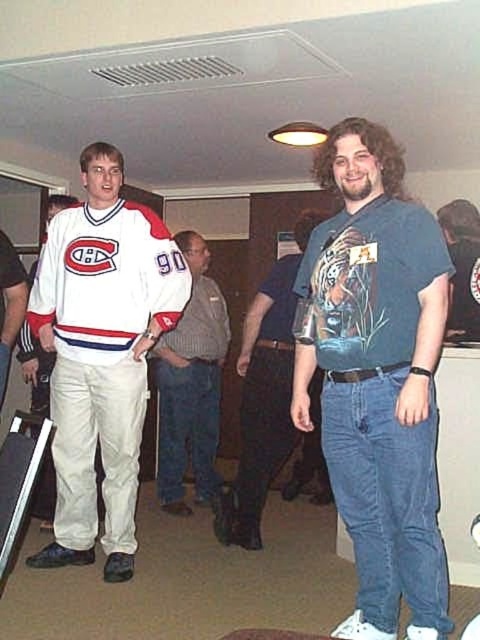
Question: Is blue printed t-shirt at center thinner than gray knit sweater at center?

Choices:
 (A) yes
 (B) no

Answer: (B)

Question: Which object is closer to the camera taking this photo?

Choices:
 (A) white jersey at left
 (B) gray knit sweater at center

Answer: (A)

Question: Which point is closer to the camera?

Choices:
 (A) pos(267,349)
 (B) pos(104,534)
 (C) pos(359,604)
 (D) pos(35,392)

Answer: (C)

Question: Which point is farther to the camera?

Choices:
 (A) (205, 490)
 (B) (38, 484)
 (C) (326, 460)

Answer: (A)

Question: From the image, what is the correct spatial relationship of blue printed t-shirt at center in relation to gray knit sweater at center?

Choices:
 (A) above
 (B) below

Answer: (A)

Question: Does blue printed t-shirt at center come behind white jersey at left?

Choices:
 (A) no
 (B) yes

Answer: (A)